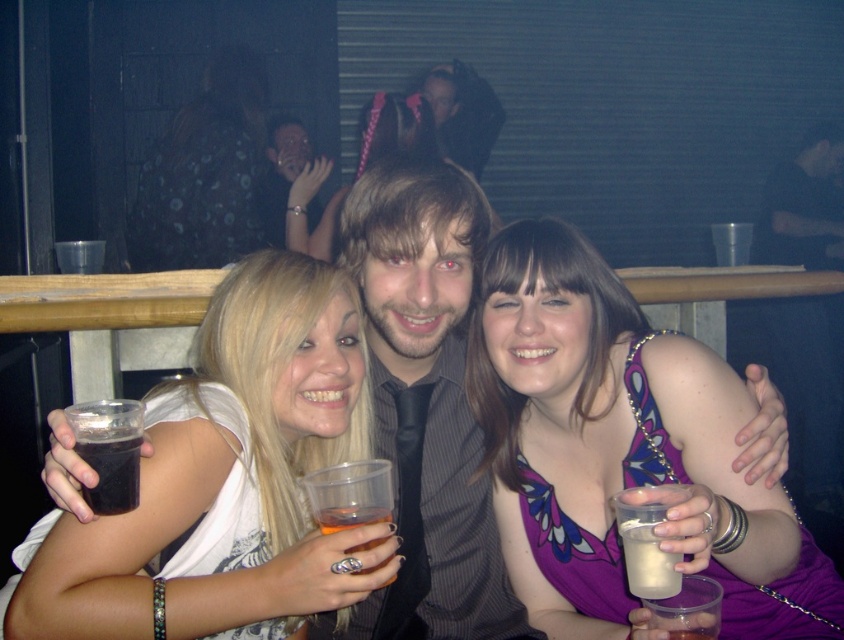
In the scene shown: Is matte black shirt at center positioned in front of dark matte cup at lower left?

No, it is behind dark matte cup at lower left.

Which is behind, point (453, 262) or point (128, 480)?

The point (453, 262) is more distant.

Locate an element on the screen. Image resolution: width=844 pixels, height=640 pixels. matte black shirt at center is located at coordinates (429, 397).

Does matte black shirt at center appear on the right side of spotted dress at upper left?

Yes, matte black shirt at center is to the right of spotted dress at upper left.

Does point (46, 472) lie behind point (152, 200)?

No, it is not.

Find the location of a particular element. The image size is (844, 640). matte black shirt at center is located at coordinates (429, 397).

Does matte plastic cup at center have a lesser height compared to dark matte cup at lower left?

Incorrect, matte plastic cup at center's height does not fall short of dark matte cup at lower left's.

What do you see at coordinates (226, 477) in the screenshot? The height and width of the screenshot is (640, 844). I see `matte plastic cup at center` at bounding box center [226, 477].

Which is in front, point (195, 365) or point (118, 492)?

Point (118, 492)

I want to click on matte plastic cup at center, so [226, 477].